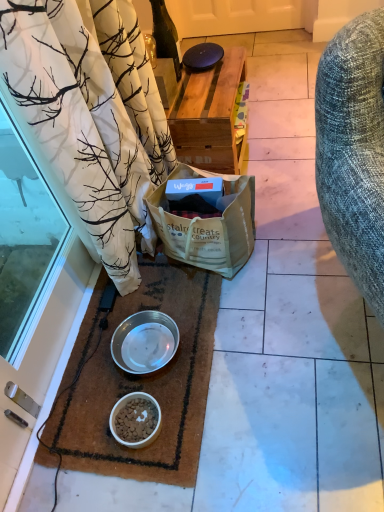
Where is `free point above brown woven mat at lower left (from a real-world perspective)`? The height and width of the screenshot is (512, 384). free point above brown woven mat at lower left (from a real-world perspective) is located at coordinates (140, 359).